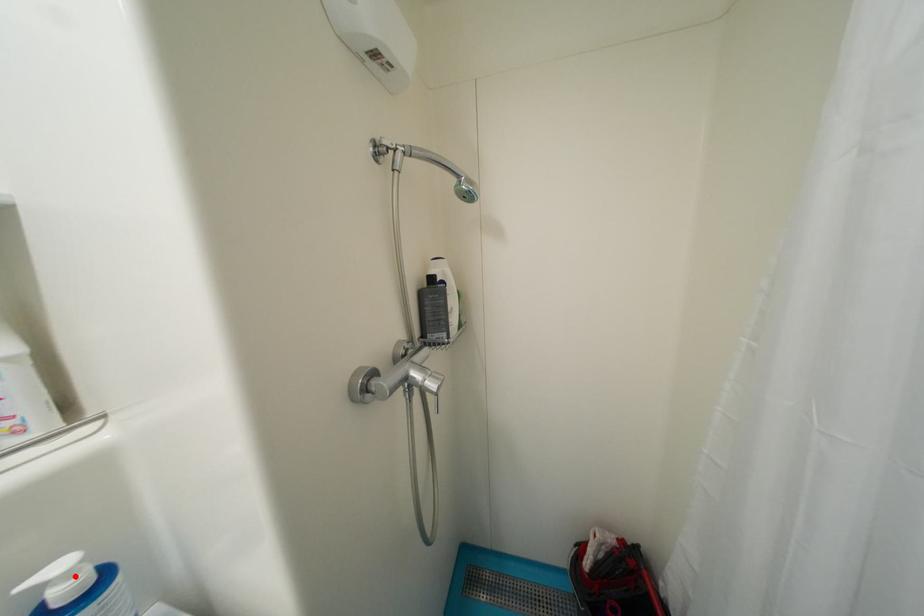
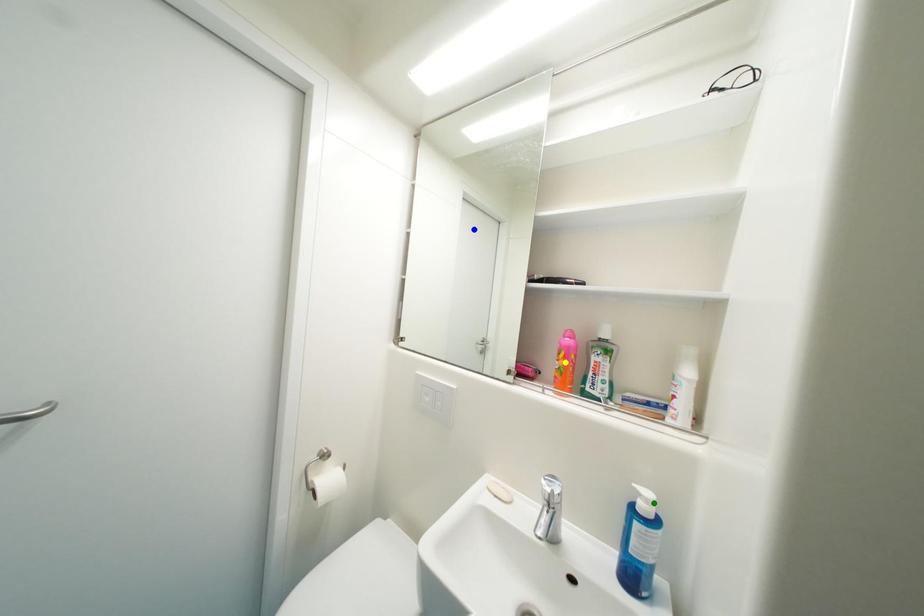
Question: I am providing you with two images of the same scene from different viewpoints. A red point is marked on the first image. You are given multiple points on the second image. Which mark in image 2 goes with the point in image 1?

Choices:
 (A) green point
 (B) yellow point
 (C) blue point

Answer: (A)